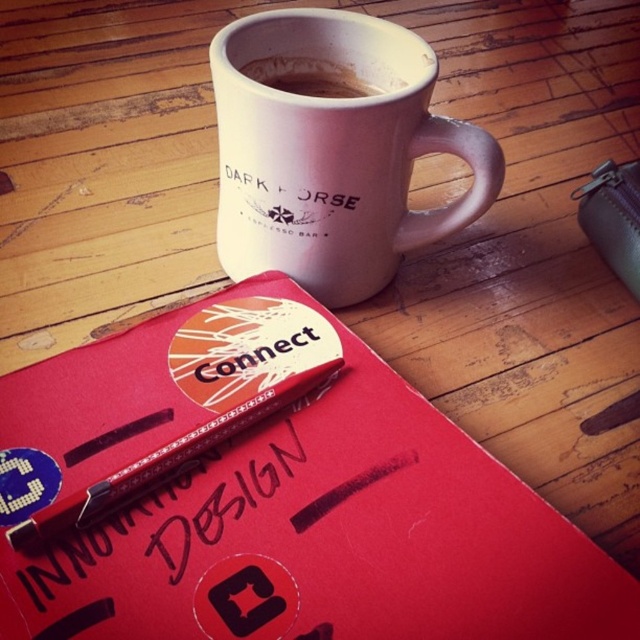
This screenshot has height=640, width=640. What do you see at coordinates (332, 150) in the screenshot? I see `white matte mug at upper center` at bounding box center [332, 150].

Between white matte mug at upper center and black pen at center, which one appears on the right side from the viewer's perspective?

white matte mug at upper center

The image size is (640, 640). What do you see at coordinates (332, 150) in the screenshot? I see `white matte mug at upper center` at bounding box center [332, 150].

Locate an element on the screen. white matte mug at upper center is located at coordinates (332, 150).

Which of these two, black pen at center or metallic silver pen at center, stands shorter?

With less height is metallic silver pen at center.

In the scene shown: Between black pen at center and metallic silver pen at center, which one appears on the left side from the viewer's perspective?

black pen at center

The image size is (640, 640). What are the coordinates of `black pen at center` in the screenshot? It's located at (172, 525).

Which of these two, red matte notebook at upper center or dark matte coffee cup at upper center, stands taller?

red matte notebook at upper center

The image size is (640, 640). I want to click on red matte notebook at upper center, so click(x=280, y=497).

Between point (282, 483) and point (292, 64), which one is positioned in front?

Point (282, 483) is more forward.

Where is `red matte notebook at upper center`? red matte notebook at upper center is located at coordinates (280, 497).